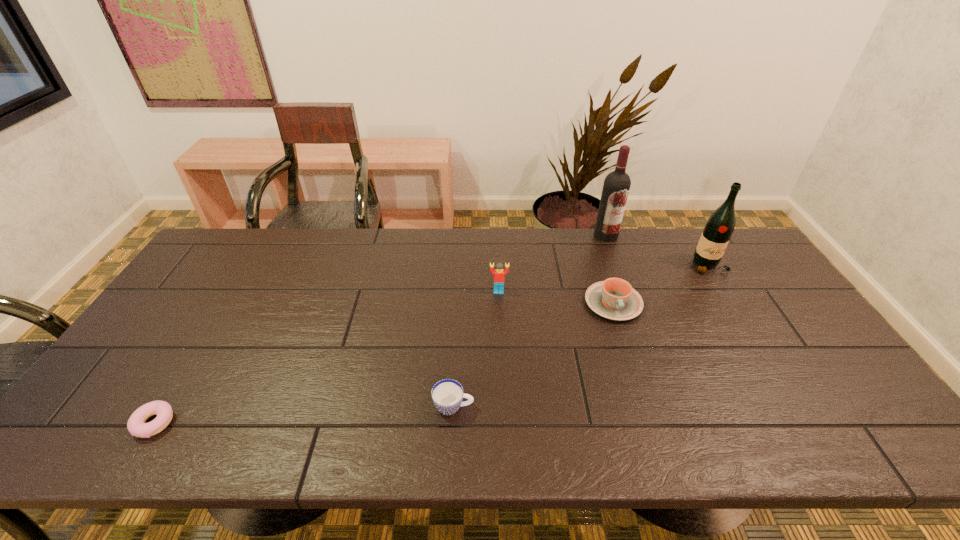
Where is `free spot located on the label of the farthest object`? The height and width of the screenshot is (540, 960). free spot located on the label of the farthest object is located at coordinates (626, 288).

Where is `free space located on the surface of the rightmost object`? This screenshot has width=960, height=540. free space located on the surface of the rightmost object is located at coordinates (768, 362).

The height and width of the screenshot is (540, 960). I want to click on vacant space located 0.230m on the face of the third tallest object, so click(501, 354).

Identify the location of vacant space located on the handle side of the chinaware. (627, 346).

I want to click on vacant area located on the side of the fifth object from right to left with the handle, so click(x=499, y=407).

Locate an element on the screen. The width and height of the screenshot is (960, 540). vacant space located 0.210m on the right of the shortest object is located at coordinates (265, 423).

Where is `cup that is at the near edge`? The width and height of the screenshot is (960, 540). cup that is at the near edge is located at coordinates (447, 395).

You are a GUI agent. You are given a task and a screenshot of the screen. Output one action in this format:
    pyautogui.click(x=<x>, y=<y>)
    Task: Click on the doughnut at the near edge
    
    Given the screenshot: What is the action you would take?
    pyautogui.click(x=136, y=425)

At what (x,y) coordinates should I click in order to perform the action: click on object situated at the left edge. Please return your answer as a coordinate pair (x, y). The width and height of the screenshot is (960, 540). Looking at the image, I should click on (136, 425).

Locate an element on the screen. object that is positioned at the right edge is located at coordinates (720, 225).